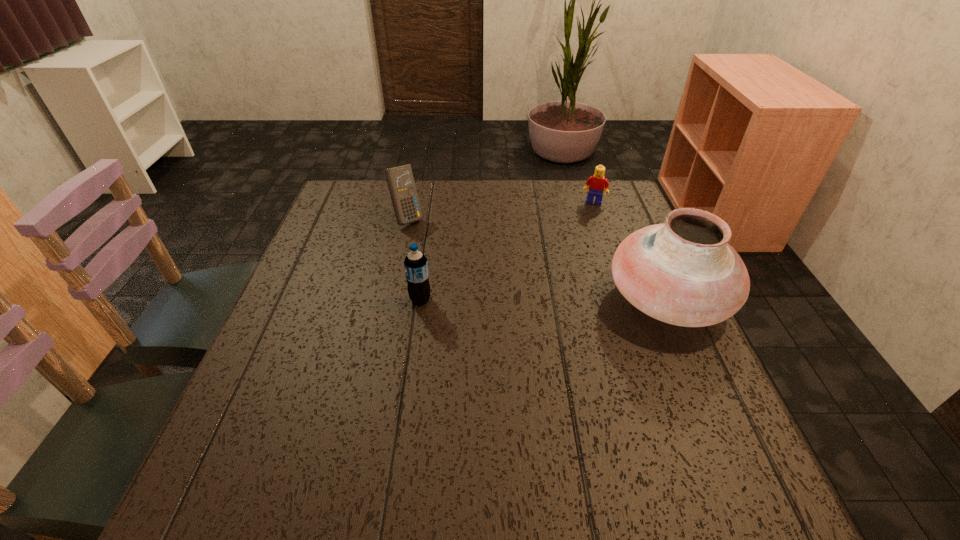
At what (x,y) coordinates should I click in order to perform the action: click on free point at the left edge. Please return your answer as a coordinate pair (x, y). The height and width of the screenshot is (540, 960). Looking at the image, I should click on point(311,390).

In the image, there is a desktop. Where is `vacant space at the right edge`? vacant space at the right edge is located at coordinates (606, 289).

In the image, there is a desktop. Find the location of `vacant space at the near left corner`. vacant space at the near left corner is located at coordinates (243, 422).

Where is `vacant space at the far right corner of the desktop`? Image resolution: width=960 pixels, height=540 pixels. vacant space at the far right corner of the desktop is located at coordinates (579, 190).

This screenshot has height=540, width=960. In the image, there is a desktop. In order to click on free space at the near right corner in this screenshot , I will do `click(699, 423)`.

At what (x,y) coordinates should I click in order to perform the action: click on unoccupied position between the third nearest object and the Lego. Please return your answer as a coordinate pair (x, y). Looking at the image, I should click on (500, 210).

This screenshot has width=960, height=540. Find the location of `free area in between the soda bottle and the pottery`. free area in between the soda bottle and the pottery is located at coordinates (544, 300).

Identify the location of vacant space that is in between the shortest object and the soda bottle. The height and width of the screenshot is (540, 960). (507, 251).

Where is `free space between the shortest object and the calculator`? The image size is (960, 540). free space between the shortest object and the calculator is located at coordinates (500, 210).

You are a GUI agent. You are given a task and a screenshot of the screen. Output one action in this format:
    pyautogui.click(x=<x>, y=<y>)
    Task: Click on the vacant area between the calculator and the shortest object
    The image size is (960, 540).
    Given the screenshot: What is the action you would take?
    pyautogui.click(x=500, y=210)